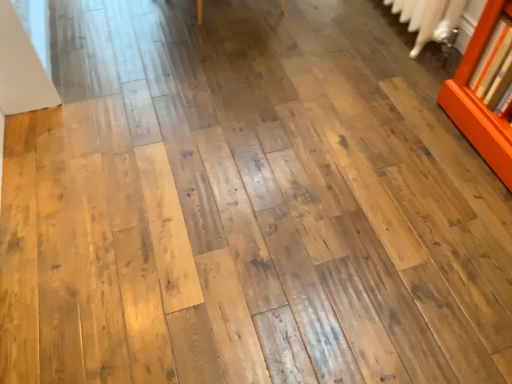
What is the approximate width of orange wood bookshelf at right?

orange wood bookshelf at right is 12.99 inches in width.

Describe the element at coordinates (478, 102) in the screenshot. I see `orange wood bookshelf at right` at that location.

Locate an element on the screen. orange wood bookshelf at right is located at coordinates (478, 102).

Measure the distance between orange wood bookshelf at right and camera.

orange wood bookshelf at right is 4.58 feet from camera.

The width and height of the screenshot is (512, 384). In order to click on orange wood bookshelf at right in this screenshot , I will do `click(478, 102)`.